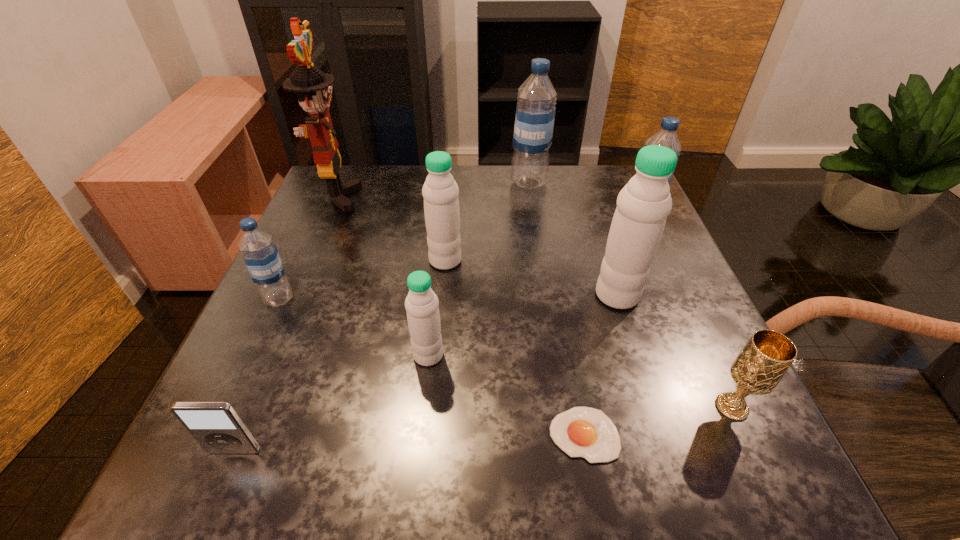
The height and width of the screenshot is (540, 960). I want to click on blank region between the nutcracker and the egg yolk, so click(x=461, y=316).

Locate an element on the screen. empty location between the farthest water bottle and the second shortest object is located at coordinates (381, 316).

Identify the location of unoccupied position between the nearest water bottle and the second smallest blue water bottle. The width and height of the screenshot is (960, 540). (535, 287).

Find the location of a particular element. Image resolution: width=960 pixels, height=540 pixels. vacant space that is in between the tallest object and the fourth nearest object is located at coordinates (383, 276).

Identify which object is the second nearest to the second shortest object. Please provide its 2D coordinates. Your answer should be formatted as a tuple, i.e. [(x, y)], where the tuple contains the x and y coordinates of a point satisfying the conditions above.

[(260, 254)]

Locate which object ranks seventh in proximity to the nutcracker. Please provide its 2D coordinates. Your answer should be formatted as a tuple, i.e. [(x, y)], where the tuple contains the x and y coordinates of a point satisfying the conditions above.

[(586, 432)]

Find the location of `water bottle that stands as the second closest to the eighth tallest object`. water bottle that stands as the second closest to the eighth tallest object is located at coordinates (423, 317).

Where is `water bottle object that ranks as the closest to the seventh nearest object`? Image resolution: width=960 pixels, height=540 pixels. water bottle object that ranks as the closest to the seventh nearest object is located at coordinates pos(423,317).

Image resolution: width=960 pixels, height=540 pixels. Identify the location of blue water bottle that is the third closest one to the fourth farthest object. (666, 136).

Locate an element on the screen. blue water bottle that is the closest one to the second biggest blue water bottle is located at coordinates (535, 113).